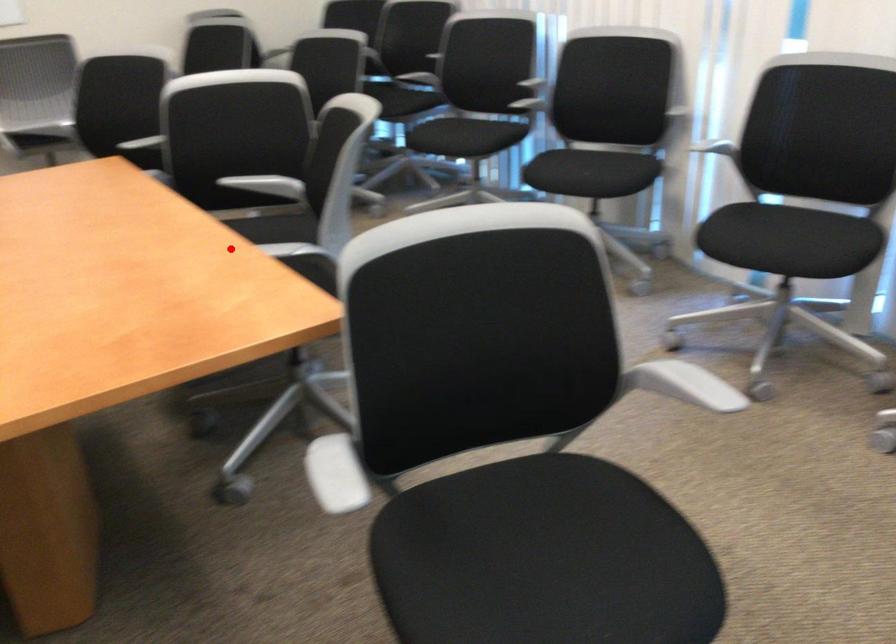
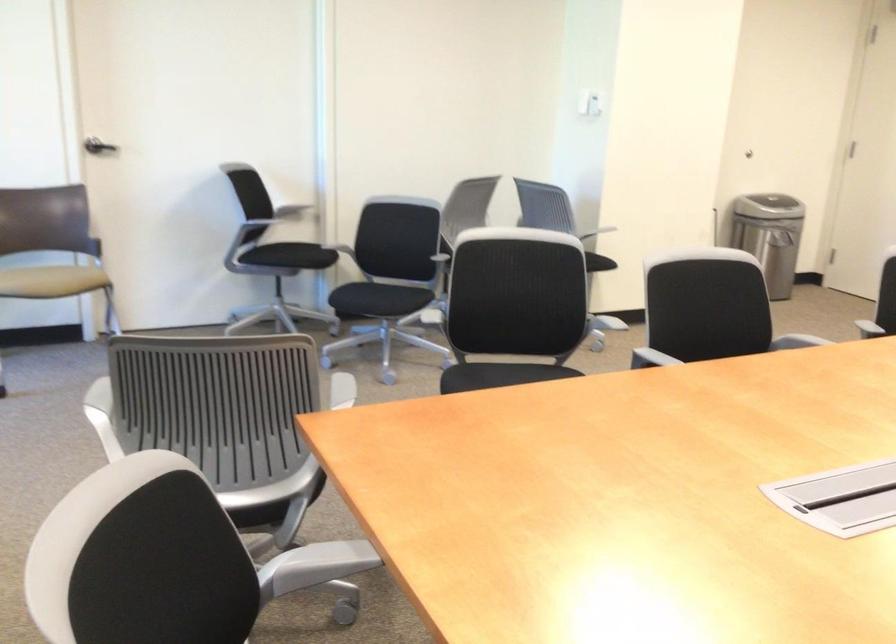
Question: I am providing you with two images of the same scene from different viewpoints. In image1, a red point is highlighted. Considering the same 3D point in image2, which of the following is correct?

Choices:
 (A) It is closer
 (B) It is farther

Answer: (A)